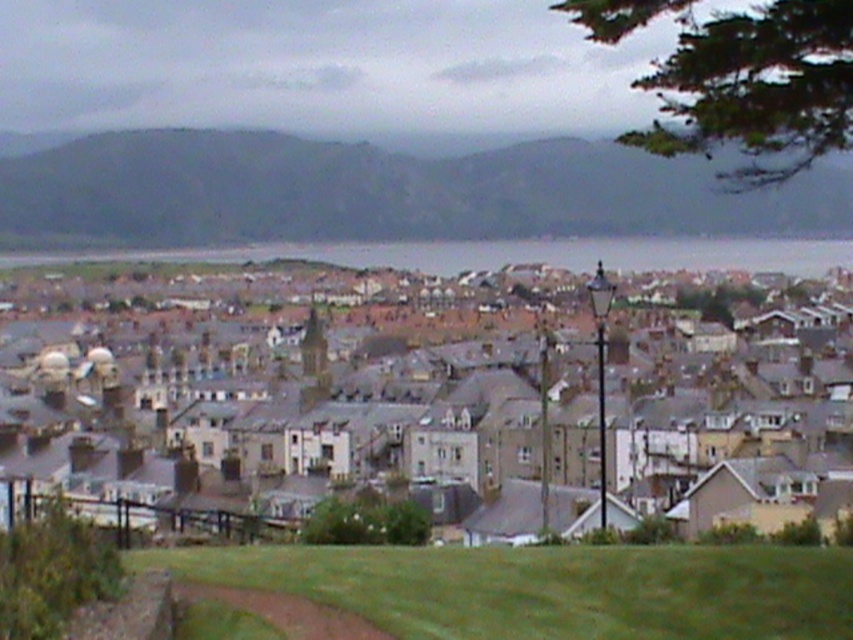
Question: Which point appears closest to the camera in this image?

Choices:
 (A) (766, 369)
 (B) (260, 582)
 (C) (314, 221)

Answer: (B)

Question: Which of the following is the closest to the observer?

Choices:
 (A) (747, 196)
 (B) (585, 237)

Answer: (A)

Question: Is gray rocky hillside at upper left below green grass at lower center?

Choices:
 (A) yes
 (B) no

Answer: (B)

Question: Among these points, which one is nearest to the camera?

Choices:
 (A) (523, 188)
 (B) (785, 628)
 (C) (521, 429)
 (D) (461, 269)

Answer: (B)

Question: Does gray stone houses at center appear under gray water at center?

Choices:
 (A) yes
 (B) no

Answer: (A)

Question: Can you confirm if gray stone houses at center is positioned above gray water at center?

Choices:
 (A) no
 (B) yes

Answer: (A)